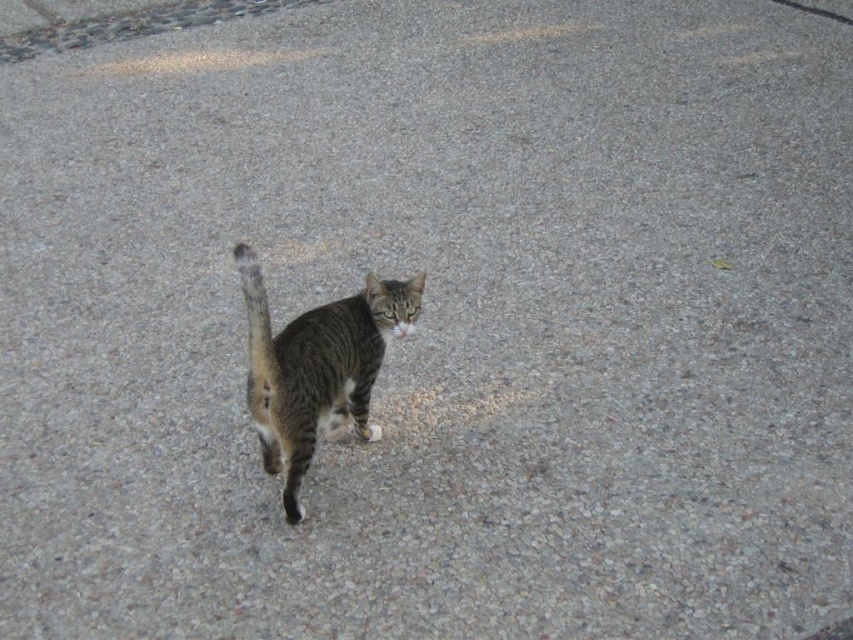
You are standing at the point marked by the coordinates point (317, 365). Looking around, you see a striped fur cat at center. What is the nearest object to you?

The nearest object to you is the striped fur cat at center, as the point (317, 365) marks its location.

You are holding a camera and want to take a closeup photo of the striped fur cat at center. The camera requires a minimum distance of 2 meters to focus properly. Can you take the photo from your current position?

The striped fur cat at center and camera are 1.94 meters apart from each other, which is less than the required 2 meters. Therefore, you cannot take the photo from your current position as the camera won not be able to focus properly.